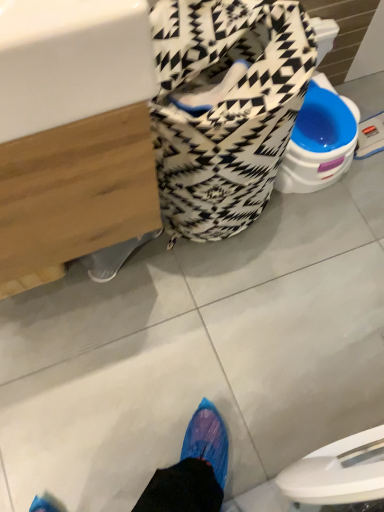
Question: Is patterned fabric laundry basket at center in contact with white glossy sink at upper left?

Choices:
 (A) no
 (B) yes

Answer: (A)

Question: Considering the relative positions of patterned fabric laundry basket at center and white glossy sink at upper left in the image provided, is patterned fabric laundry basket at center to the right of white glossy sink at upper left from the viewer's perspective?

Choices:
 (A) yes
 (B) no

Answer: (A)

Question: Considering the relative sizes of patterned fabric laundry basket at center and white glossy sink at upper left in the image provided, is patterned fabric laundry basket at center thinner than white glossy sink at upper left?

Choices:
 (A) no
 (B) yes

Answer: (B)

Question: Does patterned fabric laundry basket at center have a larger size compared to white glossy sink at upper left?

Choices:
 (A) no
 (B) yes

Answer: (A)

Question: Does patterned fabric laundry basket at center lie in front of white glossy sink at upper left?

Choices:
 (A) no
 (B) yes

Answer: (A)

Question: Can you confirm if patterned fabric laundry basket at center is taller than white glossy sink at upper left?

Choices:
 (A) no
 (B) yes

Answer: (A)

Question: Is patterned fabric laundry basket at center at the back of white glossy sink at upper left?

Choices:
 (A) no
 (B) yes

Answer: (A)

Question: Would you say white glossy sink at upper left is outside patterned fabric laundry basket at center?

Choices:
 (A) no
 (B) yes

Answer: (B)

Question: Can you confirm if white glossy sink at upper left is positioned to the left of patterned fabric laundry basket at center?

Choices:
 (A) no
 (B) yes

Answer: (B)

Question: Can you confirm if white glossy sink at upper left is thinner than patterned fabric laundry basket at center?

Choices:
 (A) yes
 (B) no

Answer: (B)

Question: From the image's perspective, is white glossy sink at upper left beneath patterned fabric laundry basket at center?

Choices:
 (A) yes
 (B) no

Answer: (A)

Question: From a real-world perspective, is white glossy sink at upper left physically above patterned fabric laundry basket at center?

Choices:
 (A) no
 (B) yes

Answer: (B)

Question: From the image's perspective, is patterned fabric laundry basket at center positioned above or below white glossy sink at upper left?

Choices:
 (A) below
 (B) above

Answer: (B)